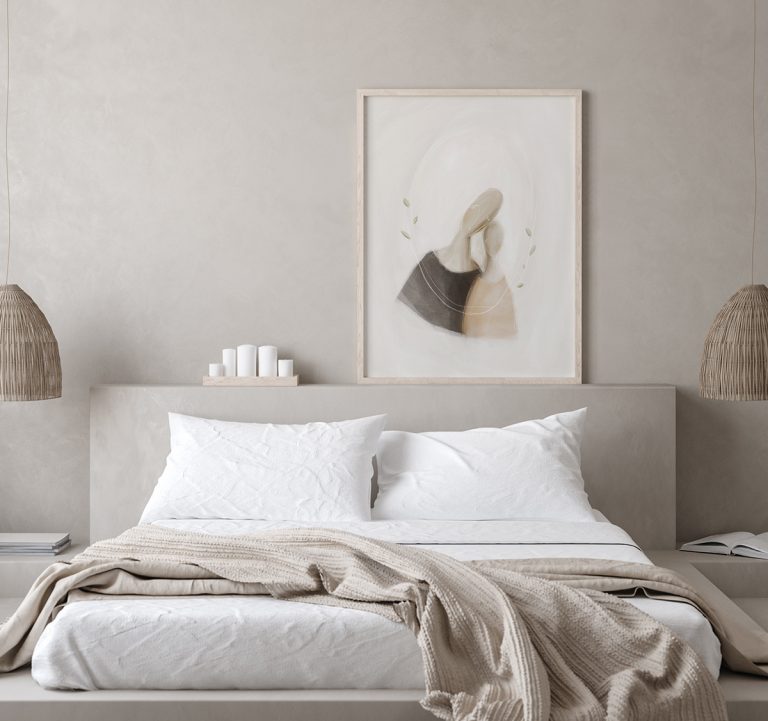
Where is `open book`? Image resolution: width=768 pixels, height=721 pixels. open book is located at coordinates point(740,546).